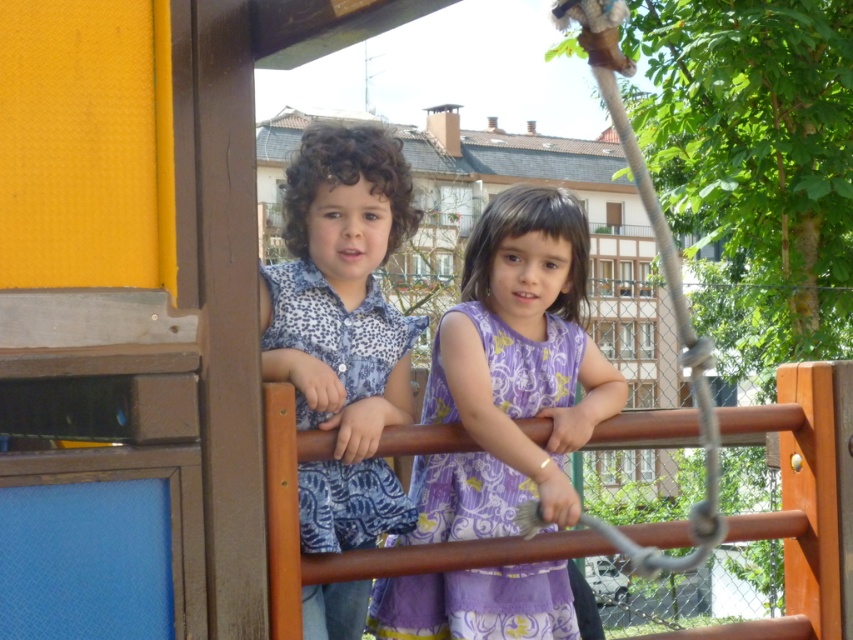
Question: Does blue patterned shirt at center have a greater width compared to purple floral fabric dress at center?

Choices:
 (A) no
 (B) yes

Answer: (A)

Question: Can you confirm if blue patterned shirt at center is positioned below purple floral fabric dress at center?

Choices:
 (A) no
 (B) yes

Answer: (A)

Question: Which of the following is the closest to the observer?

Choices:
 (A) (288, 332)
 (B) (454, 465)

Answer: (A)

Question: Which object appears farthest from the camera in this image?

Choices:
 (A) purple floral fabric dress at center
 (B) blue patterned shirt at center

Answer: (A)

Question: Is blue patterned shirt at center positioned behind purple floral fabric dress at center?

Choices:
 (A) yes
 (B) no

Answer: (B)